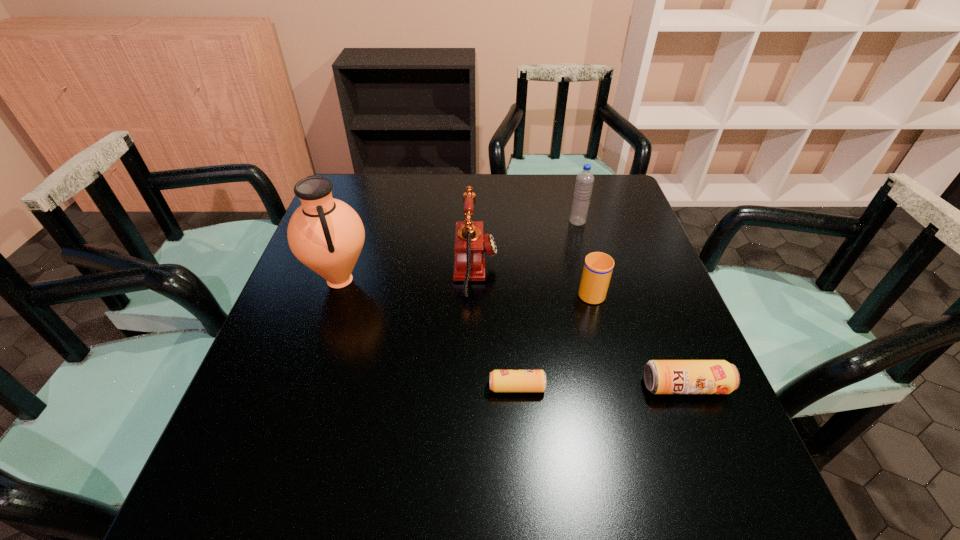
The image size is (960, 540). Find the location of `free space for a new beer can on the left`. free space for a new beer can on the left is located at coordinates (348, 388).